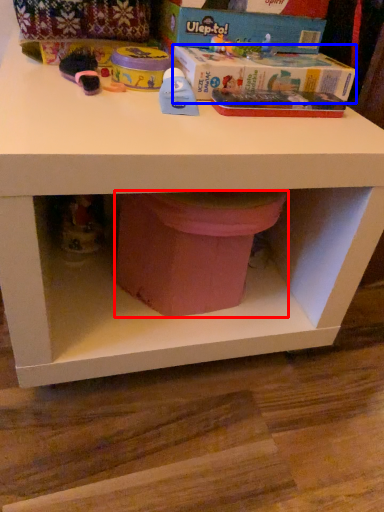
Question: Among these objects, which one is nearest to the camera, potty (highlighted by a red box) or box (highlighted by a blue box)?

Choices:
 (A) potty
 (B) box

Answer: (A)